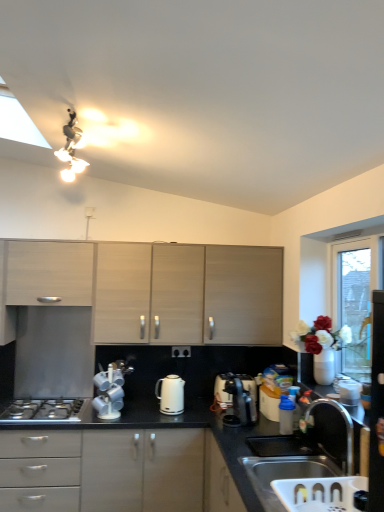
Locate an element on the screen. The image size is (384, 512). free location to the right of white glossy electric kettle at center is located at coordinates (192, 415).